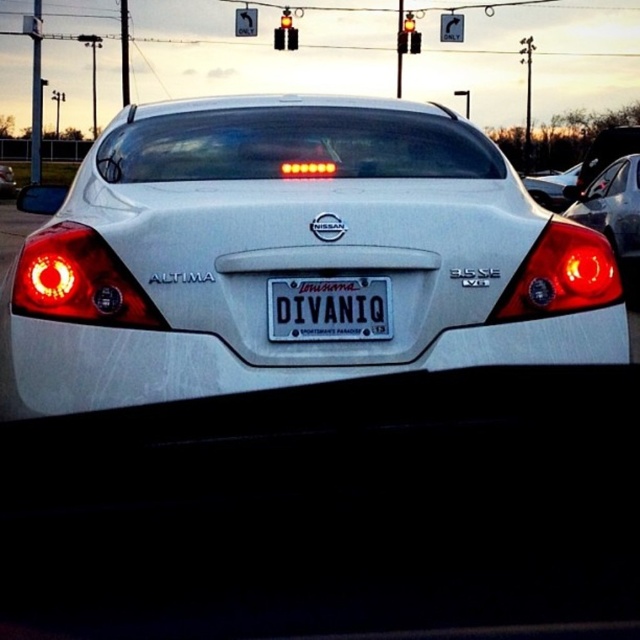
Is point (381, 284) positioned after point (561, 173)?

No, (381, 284) is in front of (561, 173).

From the picture: Which is below, white plastic license plate at center or satin silver sedan at right?

Positioned lower is white plastic license plate at center.

Is point (376, 308) more distant than point (552, 196)?

No, it is not.

Where is `white plastic license plate at center`? This screenshot has height=640, width=640. white plastic license plate at center is located at coordinates (328, 308).

Which of these two, satin silver sedan at center or red glass traffic light at center, stands taller?

satin silver sedan at center

Which of these two, satin silver sedan at center or red glass traffic light at center, stands shorter?

red glass traffic light at center

Does point (6, 177) lie in front of point (273, 44)?

No.

Where is `satin silver sedan at center`? satin silver sedan at center is located at coordinates (6, 180).

Between matte plastic brake light at right and red glass traffic light at center, which one is positioned higher?

Positioned higher is red glass traffic light at center.

Does matte plastic brake light at right have a larger size compared to red glass traffic light at center?

No.

Is point (548, 224) positioned in front of point (280, 45)?

Yes, point (548, 224) is in front of point (280, 45).

Locate an element on the screen. matte plastic brake light at right is located at coordinates (561, 275).